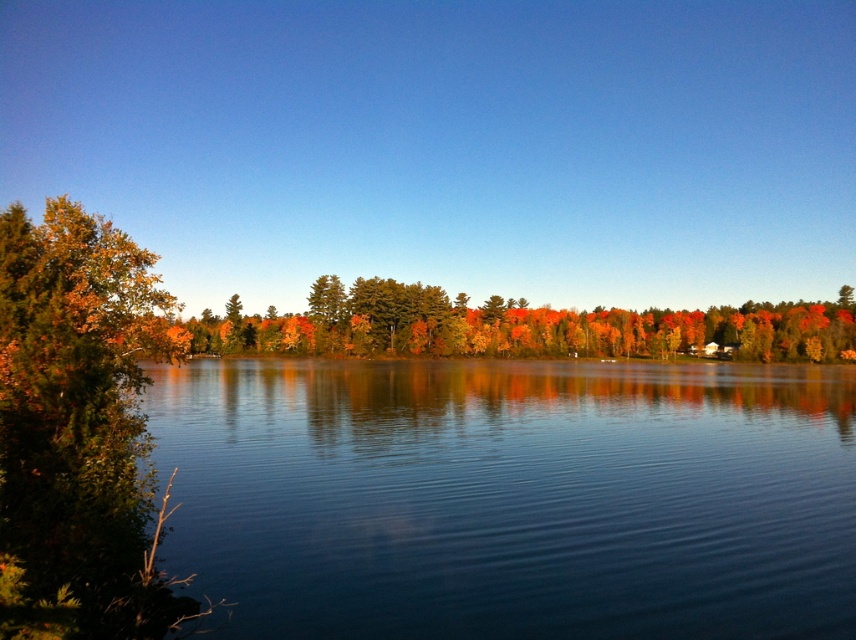
Between green leafy tree at left and autumn leaves at center, which one is positioned lower?

green leafy tree at left

The image size is (856, 640). What do you see at coordinates (79, 419) in the screenshot? I see `green leafy tree at left` at bounding box center [79, 419].

Between point (52, 435) and point (357, 296), which one is positioned in front?

Point (52, 435)

The width and height of the screenshot is (856, 640). What are the coordinates of `green leafy tree at left` in the screenshot? It's located at (79, 419).

Is point (688, 420) less distant than point (75, 294)?

No.

Does clear water at center have a lesser height compared to green leafy tree at left?

Yes.

Does point (244, 390) come closer to viewer compared to point (4, 401)?

No, it is not.

The width and height of the screenshot is (856, 640). In order to click on clear water at center in this screenshot , I will do `click(510, 497)`.

Does clear water at center lie behind autumn leaves at center?

That is False.

Between clear water at center and autumn leaves at center, which one appears on the left side from the viewer's perspective?

clear water at center is more to the left.

Image resolution: width=856 pixels, height=640 pixels. What do you see at coordinates (510, 497) in the screenshot?
I see `clear water at center` at bounding box center [510, 497].

Image resolution: width=856 pixels, height=640 pixels. Identify the location of clear water at center. (510, 497).